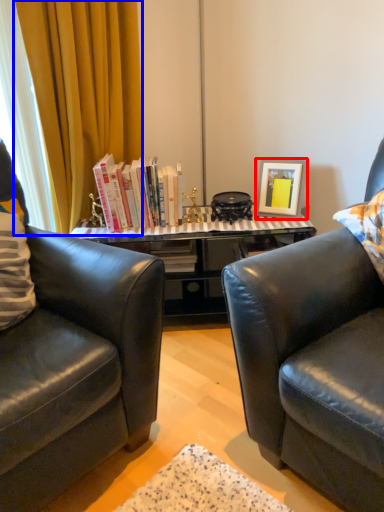
Question: Which object is closer to the camera taking this photo, picture frame (highlighted by a red box) or curtain (highlighted by a blue box)?

Choices:
 (A) picture frame
 (B) curtain

Answer: (B)